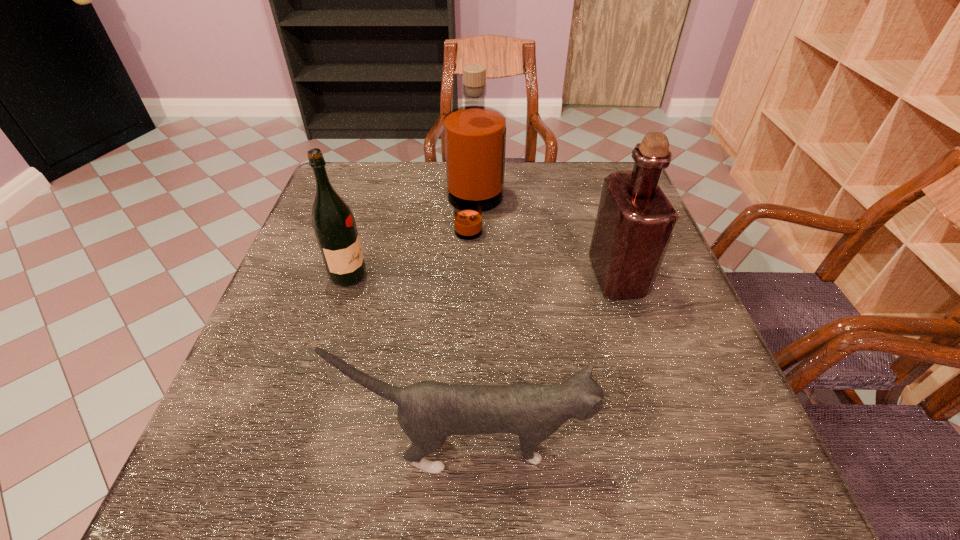
The height and width of the screenshot is (540, 960). In order to click on vacant space at the far right corner of the desktop in this screenshot , I will do `click(604, 173)`.

This screenshot has height=540, width=960. Identify the location of vacant point at the near right corner. (769, 474).

Locate an element on the screen. This screenshot has height=540, width=960. vacant area that lies between the rightmost object and the leftmost liquor is located at coordinates (483, 276).

This screenshot has width=960, height=540. Identify the location of vacant region between the leftmost object and the farthest object. (412, 242).

At what (x,y) coordinates should I click in order to perform the action: click on empty space that is in between the leftmost object and the farthest liquor. Please return your answer as a coordinate pair (x, y). Looking at the image, I should click on (412, 242).

The width and height of the screenshot is (960, 540). I want to click on free space between the farthest object and the leftmost liquor, so click(x=412, y=242).

Locate an element on the screen. The width and height of the screenshot is (960, 540). vacant space that's between the rightmost liquor and the second liquor from left to right is located at coordinates (546, 243).

I want to click on free space that is in between the shortest object and the leftmost object, so click(410, 361).

At what (x,y) coordinates should I click in order to perform the action: click on vacant area between the farthest liquor and the leftmost object. Please return your answer as a coordinate pair (x, y). This screenshot has height=540, width=960. Looking at the image, I should click on (412, 242).

Where is `vacant space that is in between the farthest liquor and the rightmost object`? This screenshot has height=540, width=960. vacant space that is in between the farthest liquor and the rightmost object is located at coordinates pos(546,243).